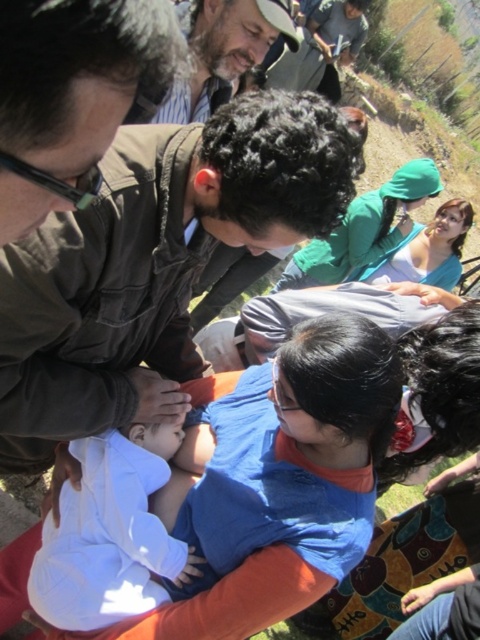
You are a photographer trying to capture a closeup of the white soft baby at center and the brown leather hat at upper center in the scene. Since the camera can only focus on one object at a time, which object should you focus on first to ensure the other is in the background?

The white soft baby at center is below brown leather hat at upper center, so you should focus on the brown leather hat at upper center first to have the white soft baby at center in the background.

You are a photographer standing at the scene. You want to take a closeup photo of the brown leather jacket at center. The camera you are using has a minimum focusing distance of 1.5 meters. Can you take the photo without moving closer?

The distance of brown leather jacket at center from camera is 1.47 meters, which is closer than the camera minimum focusing distance of 1.5 meters. Therefore, you cannot take the photo without moving further back or adjusting the camera settings.

You are a first aid instructor observing the scene. You need to ensure that the brown leather jacket at center does not cover the white soft baby at center during the demonstration. Is this possible given their sizes?

The brown leather jacket at center is bigger than the white soft baby at center, so it could potentially cover the white soft baby at center if not positioned carefully. The instructor should adjust their position to ensure visibility.